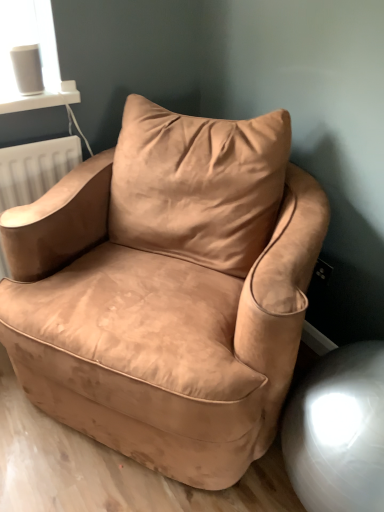
Question: Can you confirm if suede-like beige armchair at center is wider than suede tan swivel chair at lower right?

Choices:
 (A) yes
 (B) no

Answer: (A)

Question: Is suede-like beige armchair at center aimed at suede tan swivel chair at lower right?

Choices:
 (A) yes
 (B) no

Answer: (B)

Question: Considering the relative sizes of suede-like beige armchair at center and suede tan swivel chair at lower right in the image provided, is suede-like beige armchair at center thinner than suede tan swivel chair at lower right?

Choices:
 (A) no
 (B) yes

Answer: (A)

Question: Can you confirm if suede-like beige armchair at center is smaller than suede tan swivel chair at lower right?

Choices:
 (A) no
 (B) yes

Answer: (A)

Question: Does suede-like beige armchair at center contain suede tan swivel chair at lower right?

Choices:
 (A) no
 (B) yes

Answer: (A)

Question: Is suede-like beige armchair at center directly adjacent to suede tan swivel chair at lower right?

Choices:
 (A) no
 (B) yes

Answer: (A)

Question: Does suede tan swivel chair at lower right have a greater width compared to suede-like beige armchair at center?

Choices:
 (A) no
 (B) yes

Answer: (A)

Question: Is suede tan swivel chair at lower right smaller than suede-like beige armchair at center?

Choices:
 (A) yes
 (B) no

Answer: (A)

Question: Would you say suede tan swivel chair at lower right is outside suede-like beige armchair at center?

Choices:
 (A) yes
 (B) no

Answer: (A)

Question: Would you say suede-like beige armchair at center is part of suede tan swivel chair at lower right's contents?

Choices:
 (A) yes
 (B) no

Answer: (B)

Question: From the image's perspective, is suede tan swivel chair at lower right beneath suede-like beige armchair at center?

Choices:
 (A) yes
 (B) no

Answer: (A)

Question: Is suede tan swivel chair at lower right looking in the opposite direction of suede-like beige armchair at center?

Choices:
 (A) no
 (B) yes

Answer: (A)

Question: In the image, is suede tan swivel chair at lower right positioned in front of or behind suede-like beige armchair at center?

Choices:
 (A) behind
 (B) front

Answer: (A)